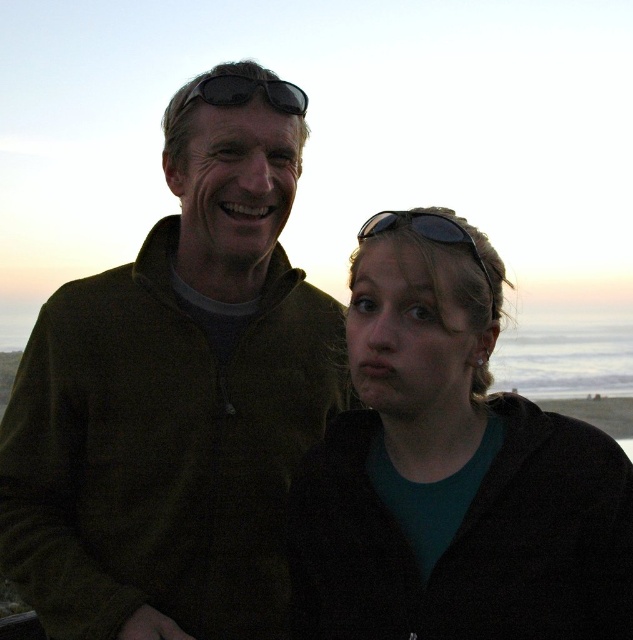
Consider the image. You are a photographer setting up for a group photo and notice the dark green fleece at left and the black plastic sunglasses at upper center in the scene. Which object is positioned lower in the image?

The dark green fleece at left is located below black plastic sunglasses at upper center, so it is positioned lower in the image.

You are a photographer trying to capture the perfect shot of the two people in the coastal scene. You notice the black matte sunglasses at upper center. Where exactly are they positioned in the image?

The black matte sunglasses at upper center are positioned at coordinates point (248, 92).

You are a photographer trying to adjust the lighting for a portrait. You notice a point at coordinates (451,468) in the image. Based on the scene description, what object is located at that point?

The point at coordinates (451,468) corresponds to the matte black jacket at center.